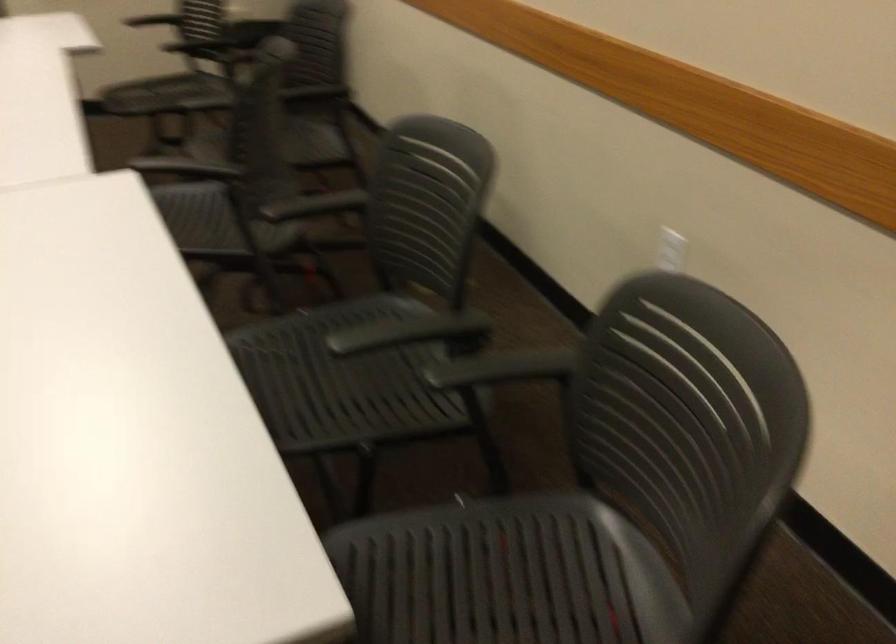
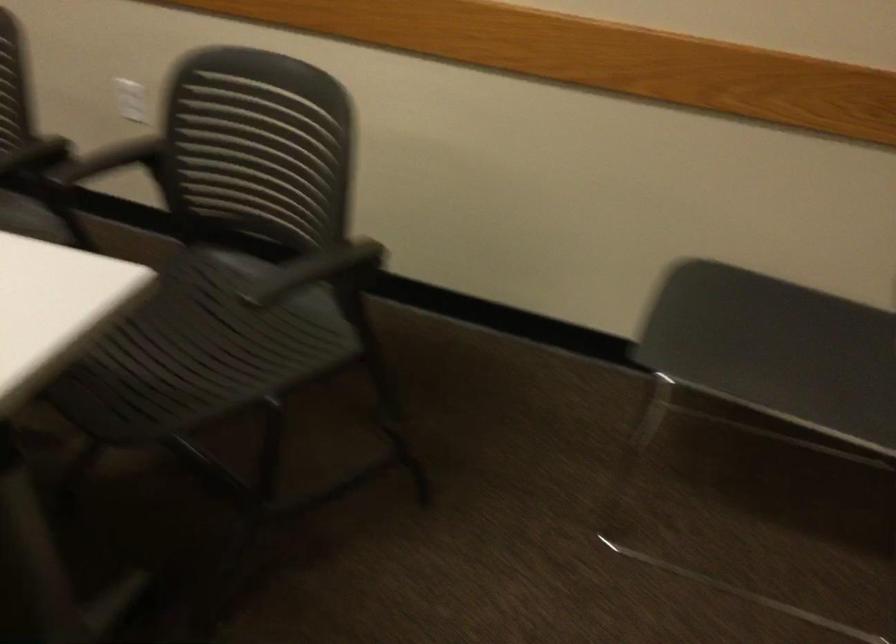
Where in the second image is the point corresponding to [428,335] from the first image?

(35, 156)